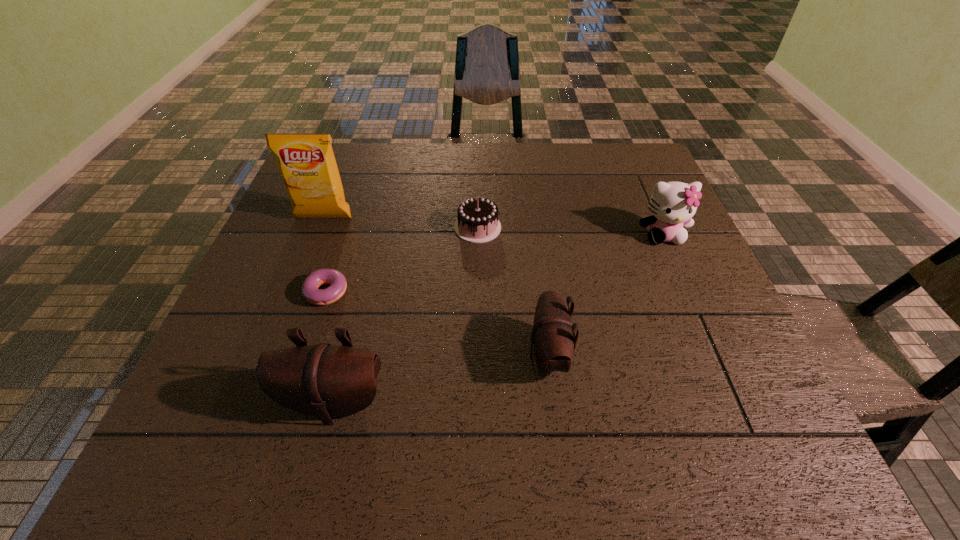
All pouchs are currently evenly spaced. To continue this pattern, where would you add another pouch on the right? Please point out a vacant spot. Please provide its 2D coordinates. Your answer should be formatted as a tuple, i.e. [(x, y)], where the tuple contains the x and y coordinates of a point satisfying the conditions above.

[(730, 315)]